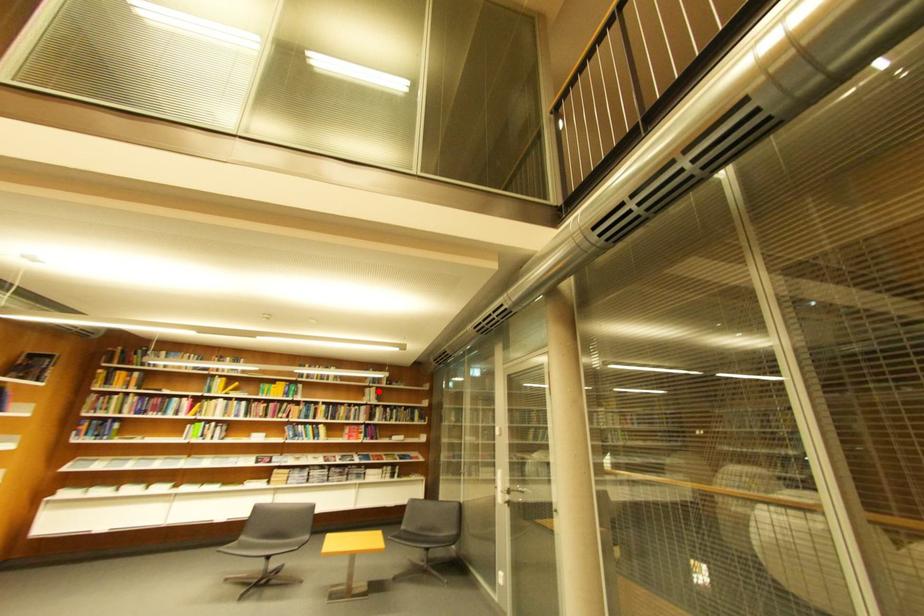
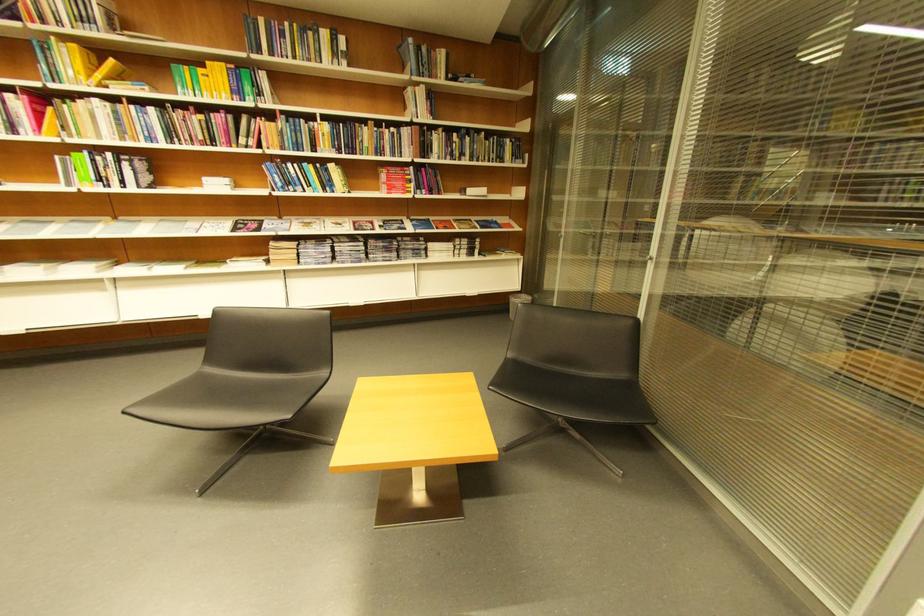
Question: I am providing you with two images of the same scene from different viewpoints. Given a red point in image1, look at the same physical point in image2. Is it:

Choices:
 (A) Closer to the viewpoint
 (B) Farther from the viewpoint

Answer: (A)